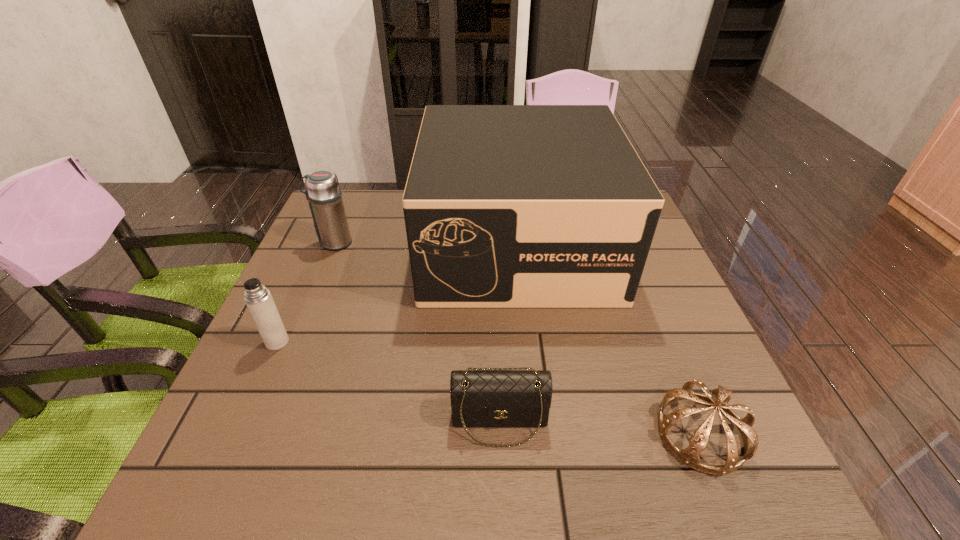
Locate an element on the screen. This screenshot has height=540, width=960. box that is at the far edge is located at coordinates (506, 206).

Find the location of a particular element. thermos bottle at the far edge is located at coordinates (323, 193).

Where is `clutch bag at the near edge`? clutch bag at the near edge is located at coordinates (482, 397).

This screenshot has height=540, width=960. In order to click on tiara that is at the near edge in this screenshot , I will do `click(720, 397)`.

What are the coordinates of `box that is at the right edge` in the screenshot? It's located at (506, 206).

The width and height of the screenshot is (960, 540). I want to click on tiara at the right edge, so click(720, 397).

Find the location of a particular element. This screenshot has height=540, width=960. object located in the far left corner section of the desktop is located at coordinates (323, 193).

This screenshot has width=960, height=540. I want to click on object present at the far right corner, so click(x=506, y=206).

What are the coordinates of `object at the near right corner` in the screenshot? It's located at (720, 397).

You are a GUI agent. You are given a task and a screenshot of the screen. Output one action in this format:
    pyautogui.click(x=<x>, y=<y>)
    Task: Click on the vacant space at the far edge
    This screenshot has width=960, height=540.
    Given the screenshot: What is the action you would take?
    pyautogui.click(x=374, y=221)